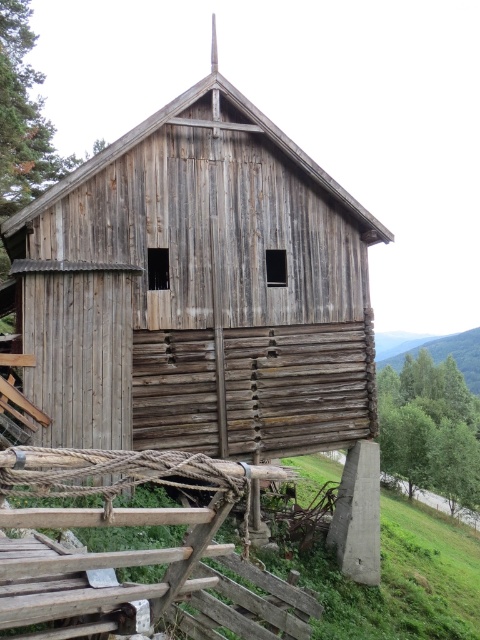
Question: Does weathered wood barn at center appear on the left side of rustic wooden fence at lower left?

Choices:
 (A) no
 (B) yes

Answer: (B)

Question: Is weathered wood barn at center behind green leafy hillside at upper right?

Choices:
 (A) yes
 (B) no

Answer: (B)

Question: Which object appears farthest from the camera in this image?

Choices:
 (A) weathered wood barn at center
 (B) rustic wooden fence at lower left

Answer: (A)

Question: Does rustic wooden fence at lower left appear on the right side of green leafy hillside at upper right?

Choices:
 (A) yes
 (B) no

Answer: (B)

Question: Which object appears farthest from the camera in this image?

Choices:
 (A) rustic wooden fence at lower left
 (B) weathered wood barn at center

Answer: (B)

Question: Which object is closer to the camera taking this photo?

Choices:
 (A) rustic wooden fence at lower left
 (B) green leafy hillside at upper right
 (C) weathered wood barn at center

Answer: (A)